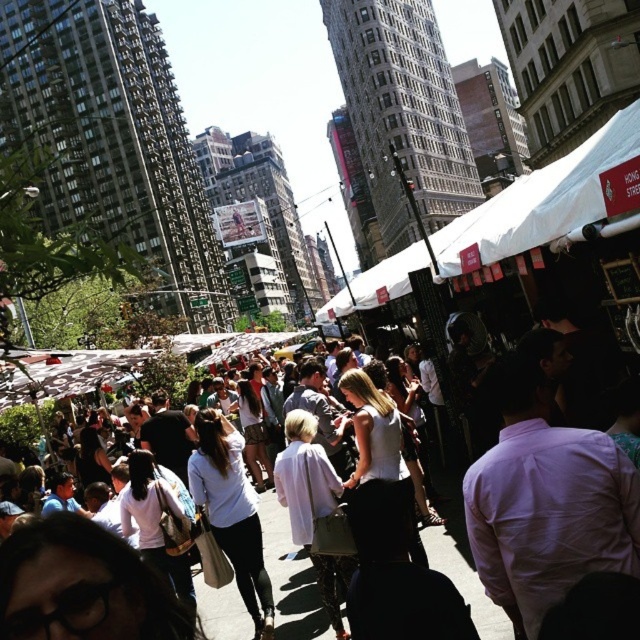
Question: Which point is farther to the camera?

Choices:
 (A) white cotton crowd at center
 (B) white fabric canopy at upper center

Answer: (A)

Question: Does white fabric canopy at upper center appear over white cotton crowd at center?

Choices:
 (A) no
 (B) yes

Answer: (B)

Question: Which of the following is the farthest from the observer?

Choices:
 (A) white fabric canopy at upper center
 (B) white cotton crowd at center

Answer: (B)

Question: Is white fabric canopy at upper center wider than white cotton crowd at center?

Choices:
 (A) no
 (B) yes

Answer: (B)

Question: Which of the following is the closest to the observer?

Choices:
 (A) (428, 554)
 (B) (352, 291)

Answer: (A)

Question: Can you confirm if white fabric canopy at upper center is bigger than white cotton crowd at center?

Choices:
 (A) no
 (B) yes

Answer: (B)